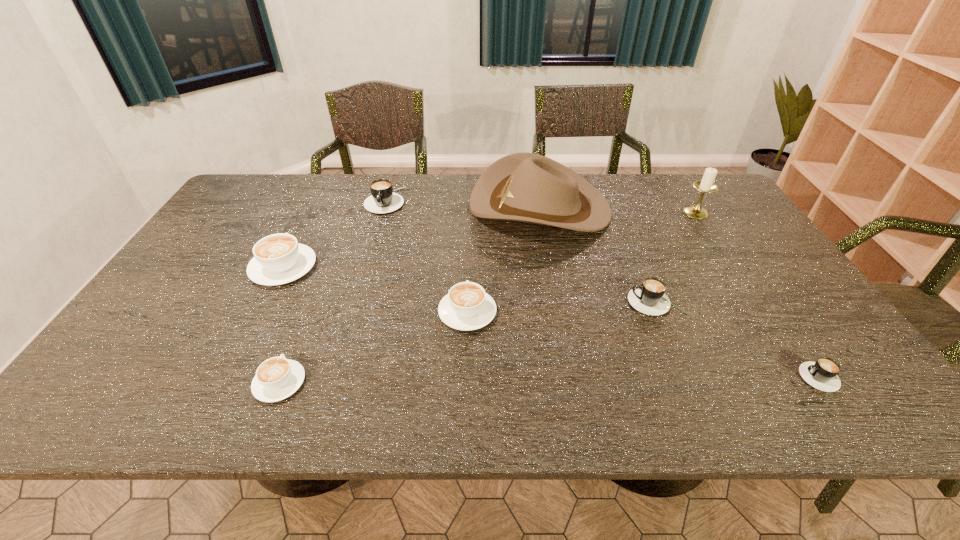
I want to click on the nearest black cappuccino, so click(x=822, y=374).

You are a GUI agent. You are given a task and a screenshot of the screen. Output one action in this format:
    pyautogui.click(x=<x>, y=<y>)
    Task: Click on the rightmost black cappuccino
    The width and height of the screenshot is (960, 540).
    Given the screenshot: What is the action you would take?
    pyautogui.click(x=822, y=374)

The height and width of the screenshot is (540, 960). What are the coordinates of `vacant space located with a star on the front of the cowboy hat` in the screenshot? It's located at (437, 206).

This screenshot has width=960, height=540. Find the location of `vacant area situated 0.280m with a star on the front of the cowboy hat`. vacant area situated 0.280m with a star on the front of the cowboy hat is located at coordinates (385, 206).

Identify the location of vacant space situated with a star on the front of the cowboy hat. (419, 206).

Where is `vacant area situated 0.290m on the front of the candle holder`? vacant area situated 0.290m on the front of the candle holder is located at coordinates (740, 281).

The image size is (960, 540). What are the coordinates of `vacant space situated 0.280m on the side of the farthest white cappuccino with the handle` in the screenshot? It's located at (320, 197).

Identify the location of vacant space situated on the side of the farthest white cappuccino with the handle. (312, 211).

Identify the location of blank area located on the side of the farthest white cappuccino with the handle. coord(317,201).

The image size is (960, 540). I want to click on vacant space located with the handle on the side of the biggest black cappuccino, so click(x=354, y=305).